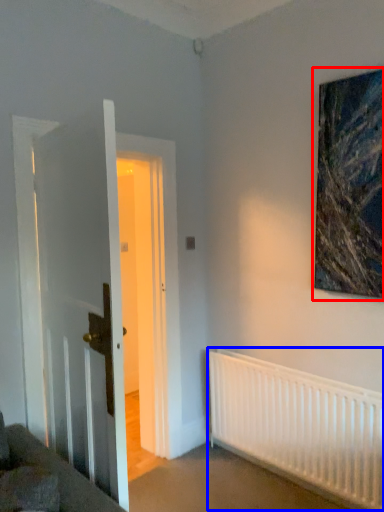
Question: Among these objects, which one is nearest to the camera, picture frame (highlighted by a red box) or radiator (highlighted by a blue box)?

Choices:
 (A) picture frame
 (B) radiator

Answer: (A)